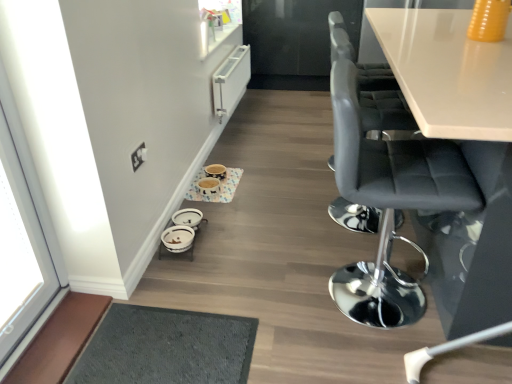
I want to click on vacant area that lies between gray fabric chair at right, the 2th chair viewed from the front, and matte ceramic bowls at center, the first round table positioned from the back, so click(x=282, y=196).